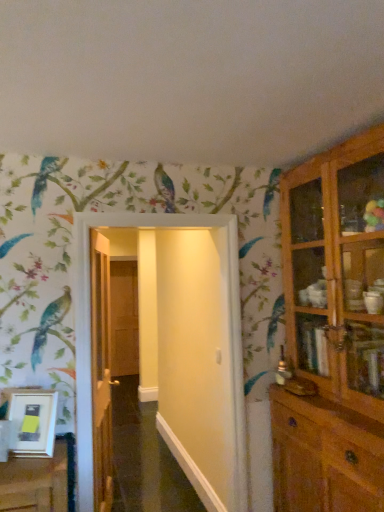
Question: From a real-world perspective, is white glossy door at center, the first door viewed from the right, located higher than brown wooden door at center, the 1th door in the left-to-right sequence?

Choices:
 (A) no
 (B) yes

Answer: (B)

Question: Does white glossy door at center, the first door viewed from the right, come in front of brown wooden door at center, arranged as the third door when viewed from the right?

Choices:
 (A) yes
 (B) no

Answer: (A)

Question: Is white glossy door at center, which appears as the 3th door when viewed from the back, far from brown wooden door at center, the 1th door in the left-to-right sequence?

Choices:
 (A) no
 (B) yes

Answer: (B)

Question: Is white glossy door at center, the 3th door positioned from the left, facing away from brown wooden door at center, the third door when ordered from front to back?

Choices:
 (A) yes
 (B) no

Answer: (A)

Question: Considering the relative sizes of white glossy door at center, the 3th door positioned from the left, and brown wooden door at center, the 1th door in the left-to-right sequence, in the image provided, is white glossy door at center, the 3th door positioned from the left, smaller than brown wooden door at center, the 1th door in the left-to-right sequence,?

Choices:
 (A) yes
 (B) no

Answer: (B)

Question: From a real-world perspective, is white glossy door at center, the 3th door positioned from the left, physically located above or below brown wooden door at center, the third door when ordered from front to back?

Choices:
 (A) below
 (B) above

Answer: (B)

Question: In terms of width, does white glossy door at center, the 3th door positioned from the left, look wider or thinner when compared to brown wooden door at center, the 1th door in the left-to-right sequence?

Choices:
 (A) thin
 (B) wide

Answer: (B)

Question: Visually, is white glossy door at center, the 3th door positioned from the left, positioned to the left or to the right of brown wooden door at center, arranged as the third door when viewed from the right?

Choices:
 (A) left
 (B) right

Answer: (B)

Question: Is white glossy door at center, the 1th door viewed from the front, taller or shorter than brown wooden door at center, the third door when ordered from front to back?

Choices:
 (A) tall
 (B) short

Answer: (B)

Question: Is white glossy door at center, the 1th door viewed from the front, to the left or to the right of white matte picture frame at lower left in the image?

Choices:
 (A) left
 (B) right

Answer: (B)

Question: In terms of height, does white glossy door at center, the 3th door positioned from the left, look taller or shorter compared to white matte picture frame at lower left?

Choices:
 (A) tall
 (B) short

Answer: (A)

Question: Is point (158, 229) positioned closer to the camera than point (31, 429)?

Choices:
 (A) closer
 (B) farther

Answer: (B)

Question: Considering their positions, is white glossy door at center, which appears as the 3th door when viewed from the back, located in front of or behind white matte picture frame at lower left?

Choices:
 (A) behind
 (B) front

Answer: (A)

Question: From a real-world perspective, is wooden door at center, the second door in the front-to-back sequence, above or below brown wooden door at center, the third door when ordered from front to back?

Choices:
 (A) above
 (B) below

Answer: (B)

Question: Does point (107, 497) appear closer or farther from the camera than point (119, 311)?

Choices:
 (A) closer
 (B) farther

Answer: (A)